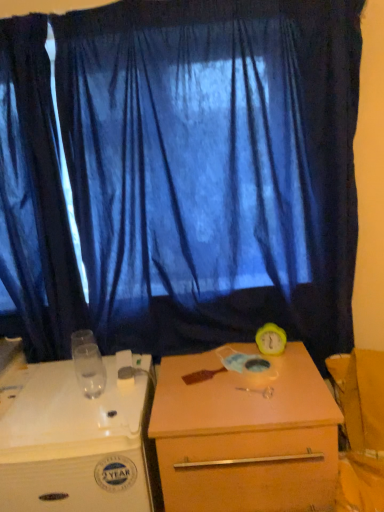
Question: Is the depth of blue fabric curtain at center, positioned as the 1th curtain in right-to-left order, greater than that of matte wooden desk at center, placed as the first desk when sorted from right to left?

Choices:
 (A) yes
 (B) no

Answer: (A)

Question: Is matte wooden desk at center, the second desk positioned from the left, at the back of blue fabric curtain at center, the second curtain when ordered from left to right?

Choices:
 (A) no
 (B) yes

Answer: (A)

Question: Does blue fabric curtain at center, the second curtain when ordered from left to right, appear on the left side of matte wooden desk at center, placed as the first desk when sorted from right to left?

Choices:
 (A) yes
 (B) no

Answer: (A)

Question: Is blue fabric curtain at center, positioned as the 1th curtain in right-to-left order, touching matte wooden desk at center, the second desk positioned from the left?

Choices:
 (A) no
 (B) yes

Answer: (A)

Question: Considering the relative sizes of blue fabric curtain at center, the second curtain when ordered from left to right, and matte wooden desk at center, the second desk positioned from the left, in the image provided, is blue fabric curtain at center, the second curtain when ordered from left to right, shorter than matte wooden desk at center, the second desk positioned from the left,?

Choices:
 (A) no
 (B) yes

Answer: (A)

Question: Is blue fabric curtain at center, the second curtain when ordered from left to right, positioned beyond the bounds of matte wooden desk at center, placed as the first desk when sorted from right to left?

Choices:
 (A) no
 (B) yes

Answer: (B)

Question: Is yellow rubber alarm clock at right facing towards dark blue fabric curtain at left, which is counted as the 1th curtain, starting from the left?

Choices:
 (A) yes
 (B) no

Answer: (B)

Question: Is yellow rubber alarm clock at right with dark blue fabric curtain at left, which is counted as the 1th curtain, starting from the left?

Choices:
 (A) yes
 (B) no

Answer: (B)

Question: Does yellow rubber alarm clock at right have a lesser width compared to dark blue fabric curtain at left, which is counted as the second curtain, starting from the right?

Choices:
 (A) yes
 (B) no

Answer: (A)

Question: Can you confirm if yellow rubber alarm clock at right is taller than dark blue fabric curtain at left, which is counted as the 1th curtain, starting from the left?

Choices:
 (A) yes
 (B) no

Answer: (B)

Question: Can you confirm if yellow rubber alarm clock at right is positioned to the left of dark blue fabric curtain at left, which is counted as the second curtain, starting from the right?

Choices:
 (A) no
 (B) yes

Answer: (A)

Question: From a real-world perspective, is yellow rubber alarm clock at right physically below dark blue fabric curtain at left, which is counted as the second curtain, starting from the right?

Choices:
 (A) no
 (B) yes

Answer: (B)

Question: Is blue fabric curtain at center, the second curtain when ordered from left to right, beside white plastic desk at lower left, the second desk positioned from the right?

Choices:
 (A) no
 (B) yes

Answer: (A)